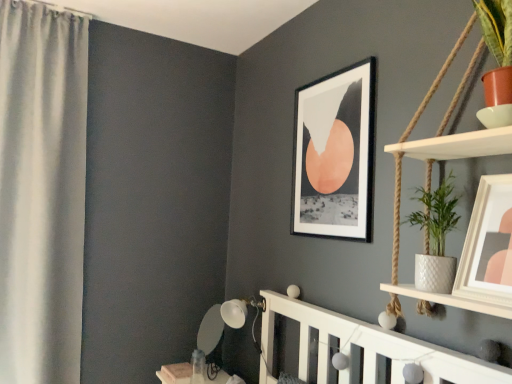
Question: From a real-world perspective, is white textured pot at right physically below matte white picture frame at upper right, the first picture frame viewed from the right?

Choices:
 (A) no
 (B) yes

Answer: (A)

Question: Is white textured pot at right directly adjacent to matte white picture frame at upper right, the 2th picture frame from the left?

Choices:
 (A) no
 (B) yes

Answer: (A)

Question: Considering the relative sizes of white textured pot at right and matte white picture frame at upper right, which appears as the first picture frame when viewed from the front, in the image provided, is white textured pot at right wider than matte white picture frame at upper right, which appears as the first picture frame when viewed from the front,?

Choices:
 (A) yes
 (B) no

Answer: (A)

Question: Considering the relative sizes of white textured pot at right and matte white picture frame at upper right, which appears as the first picture frame when viewed from the front, in the image provided, is white textured pot at right bigger than matte white picture frame at upper right, which appears as the first picture frame when viewed from the front,?

Choices:
 (A) yes
 (B) no

Answer: (A)

Question: Does white textured pot at right have a lesser width compared to matte white picture frame at upper right, the second picture frame from the back?

Choices:
 (A) no
 (B) yes

Answer: (A)

Question: In terms of height, does matte white picture frame at upper right, the second picture frame from the back, look taller or shorter compared to white textured pot at right?

Choices:
 (A) tall
 (B) short

Answer: (B)

Question: From the image's perspective, relative to white textured pot at right, is matte white picture frame at upper right, the 2th picture frame from the left, above or below?

Choices:
 (A) below
 (B) above

Answer: (A)

Question: From a real-world perspective, is matte white picture frame at upper right, the 2th picture frame from the left, above or below white textured pot at right?

Choices:
 (A) above
 (B) below

Answer: (B)

Question: Considering their positions, is matte white picture frame at upper right, the second picture frame from the back, located in front of or behind white textured pot at right?

Choices:
 (A) behind
 (B) front

Answer: (B)

Question: Considering the positions of matte white picture frame at upper right, the first picture frame viewed from the right, and black matte picture frame at upper center, which is the second picture frame from right to left, in the image, is matte white picture frame at upper right, the first picture frame viewed from the right, taller or shorter than black matte picture frame at upper center, which is the second picture frame from right to left,?

Choices:
 (A) short
 (B) tall

Answer: (A)

Question: From the image's perspective, is matte white picture frame at upper right, the first picture frame viewed from the right, above or below black matte picture frame at upper center, which appears as the second picture frame when viewed from the front?

Choices:
 (A) below
 (B) above

Answer: (A)

Question: Is matte white picture frame at upper right, the 2th picture frame from the left, bigger or smaller than black matte picture frame at upper center, which is the second picture frame from right to left?

Choices:
 (A) small
 (B) big

Answer: (A)

Question: Visually, is matte white picture frame at upper right, the first picture frame viewed from the right, positioned to the left or to the right of black matte picture frame at upper center, acting as the first picture frame starting from the back?

Choices:
 (A) right
 (B) left

Answer: (A)

Question: Visually, is white fabric curtain at left positioned to the left or to the right of black matte picture frame at upper center, acting as the first picture frame starting from the left?

Choices:
 (A) left
 (B) right

Answer: (A)

Question: Is point (28, 107) closer or farther from the camera than point (343, 129)?

Choices:
 (A) closer
 (B) farther

Answer: (B)